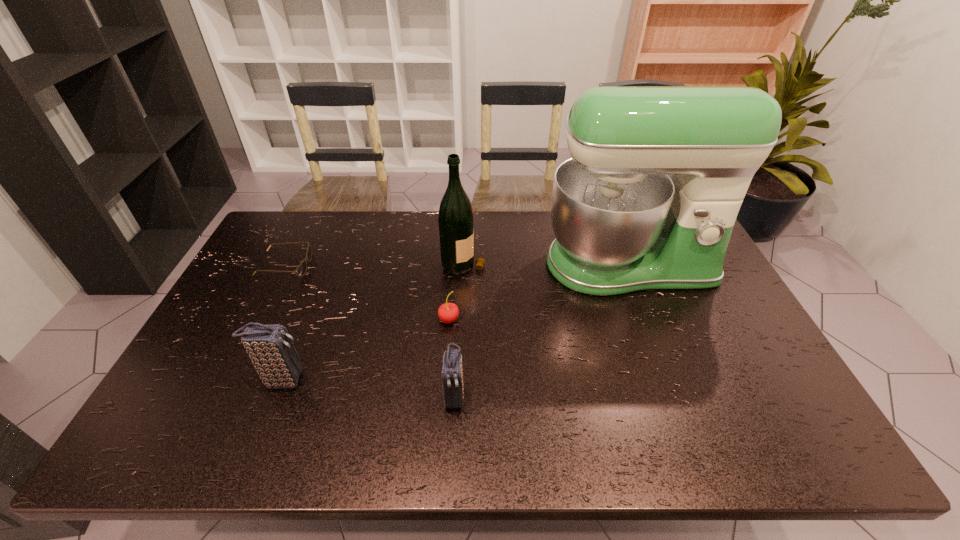
Image resolution: width=960 pixels, height=540 pixels. I want to click on free space located with the zip open on the fourth shortest object, so click(343, 380).

The width and height of the screenshot is (960, 540). What are the coordinates of `free region located on the lenses of the sunglasses` in the screenshot? It's located at (383, 266).

In order to click on blank space located 0.130m on the right of the fifth shortest object in this screenshot , I will do `click(524, 261)`.

At what (x,y) coordinates should I click in order to perform the action: click on free spot located on the controls of the mixer. Please return your answer as a coordinate pair (x, y). Looking at the image, I should click on (660, 348).

Locate an element on the screen. The image size is (960, 540). vacant region located on the left of the fourth farthest object is located at coordinates (345, 319).

Locate an element on the screen. The width and height of the screenshot is (960, 540). wine bottle at the far edge is located at coordinates tap(456, 230).

At what (x,y) coordinates should I click in order to perform the action: click on mixer located at the far edge. Please return your answer as a coordinate pair (x, y). This screenshot has height=540, width=960. Looking at the image, I should click on (621, 224).

I want to click on object that is at the left edge, so click(301, 269).

The image size is (960, 540). What are the coordinates of `object located at the right edge` in the screenshot? It's located at (621, 224).

Identify the location of object located in the far right corner section of the desktop. Image resolution: width=960 pixels, height=540 pixels. (621, 224).